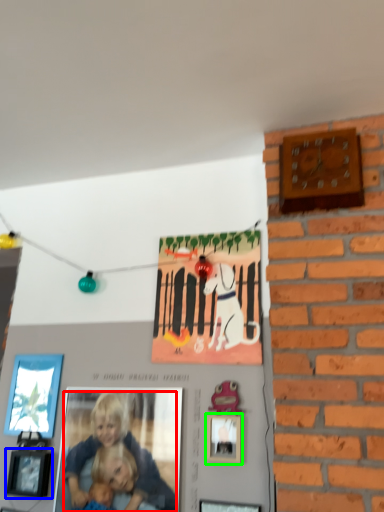
Question: Which is nearer to the person (highlighted by a red box)? picture frame (highlighted by a blue box) or picture frame (highlighted by a green box).

Choices:
 (A) picture frame
 (B) picture frame

Answer: (A)